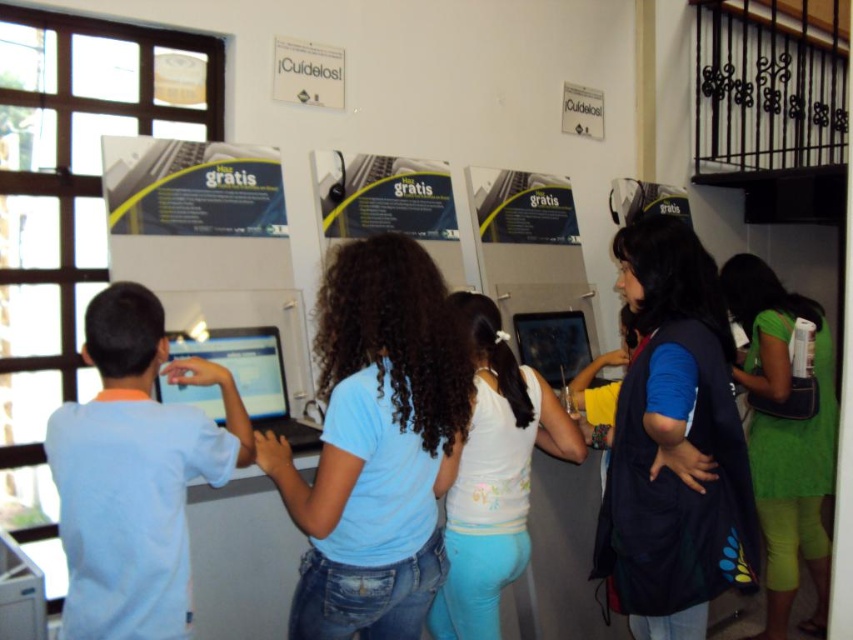
Can you confirm if blue cotton shirt at center is positioned to the left of white matte tank top at center?

Answer: Correct, you'll find blue cotton shirt at center to the left of white matte tank top at center.

Which is more to the left, blue cotton shirt at center or white matte tank top at center?

blue cotton shirt at center

Image resolution: width=853 pixels, height=640 pixels. What do you see at coordinates (375, 444) in the screenshot?
I see `blue cotton shirt at center` at bounding box center [375, 444].

Locate an element on the screen. The width and height of the screenshot is (853, 640). blue cotton shirt at center is located at coordinates (375, 444).

Looking at this image, does blue cotton shirt at center appear on the right side of green fabric dress at right?

No, blue cotton shirt at center is not to the right of green fabric dress at right.

Find the location of a particular element. blue cotton shirt at center is located at coordinates (375, 444).

The width and height of the screenshot is (853, 640). Find the location of `blue cotton shirt at center`. blue cotton shirt at center is located at coordinates (375, 444).

Is blue cotton shirt at center above dark blue fabric vest at center right?

Indeed, blue cotton shirt at center is positioned over dark blue fabric vest at center right.

Image resolution: width=853 pixels, height=640 pixels. Identify the location of blue cotton shirt at center. (375, 444).

Locate an element on the screen. The image size is (853, 640). blue cotton shirt at center is located at coordinates point(375,444).